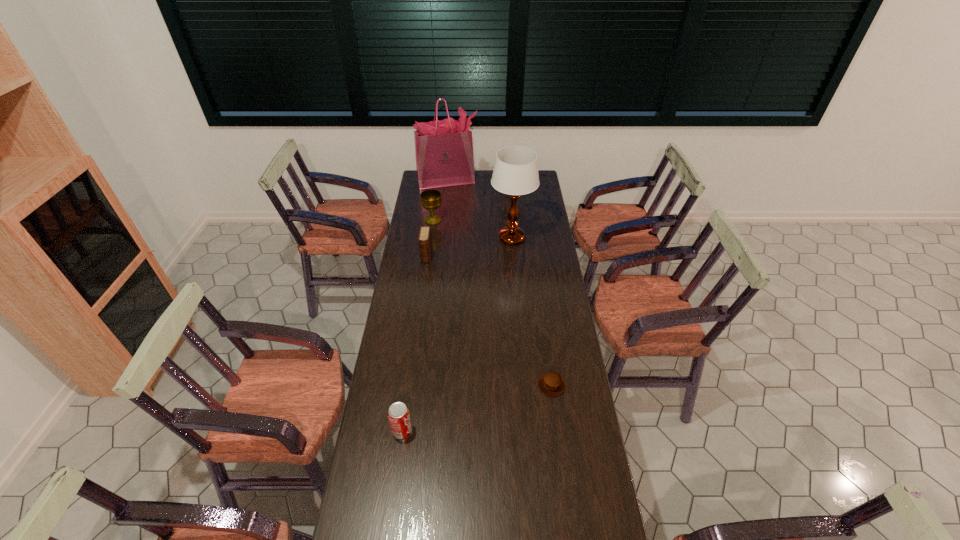
You are a GUI agent. You are given a task and a screenshot of the screen. Output one action in this format:
    pyautogui.click(x=<x>, y=<y>)
    Task: Click on the object that is at the far left corner
    This screenshot has height=540, width=960.
    Given the screenshot: What is the action you would take?
    pyautogui.click(x=444, y=156)

In the image, there is a desktop. Identify the location of vacant space at the left edge. (416, 293).

You are a GUI agent. You are given a task and a screenshot of the screen. Output one action in this format:
    pyautogui.click(x=<x>, y=<y>)
    Task: Click on the free location at the right edge of the desktop
    The image size is (960, 540).
    Given the screenshot: What is the action you would take?
    pyautogui.click(x=551, y=265)

Where is `free point between the diary and the soda can`? This screenshot has height=540, width=960. free point between the diary and the soda can is located at coordinates (415, 343).

Identify the location of unoccupied area between the muffin and the diary. (490, 320).

This screenshot has height=540, width=960. I want to click on vacant point located between the table lamp and the farthest object, so click(x=479, y=209).

Where is `free space that is in between the chalice and the soda can`? The image size is (960, 540). free space that is in between the chalice and the soda can is located at coordinates (418, 325).

I want to click on vacant space that is in between the farthest object and the second nearest object, so click(x=499, y=283).

This screenshot has height=540, width=960. What are the coordinates of `vacant space in between the nearest object and the diary` in the screenshot? It's located at (415, 343).

The width and height of the screenshot is (960, 540). Find the location of `the closest object to the soda can`. the closest object to the soda can is located at coordinates (552, 384).